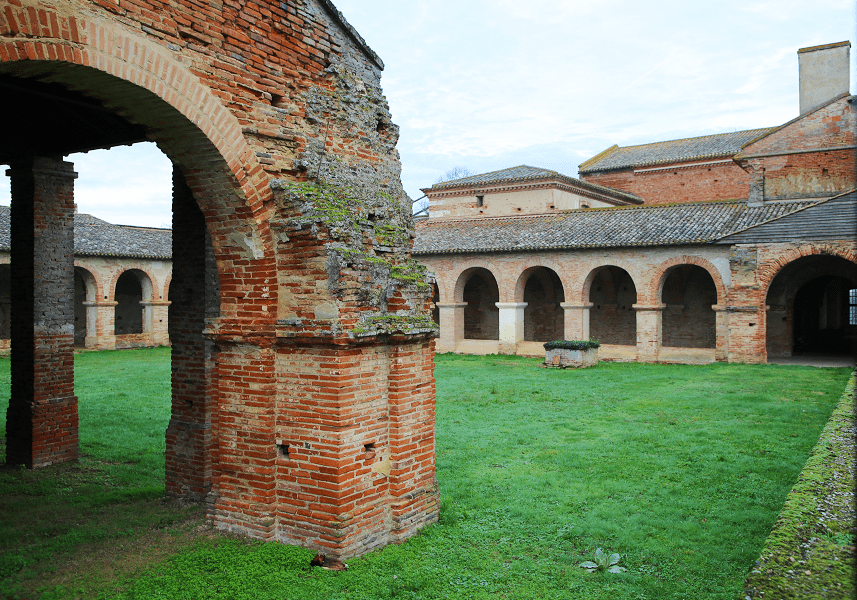
Locate an element on the screen. The width and height of the screenshot is (857, 600). chimney is located at coordinates (828, 61).